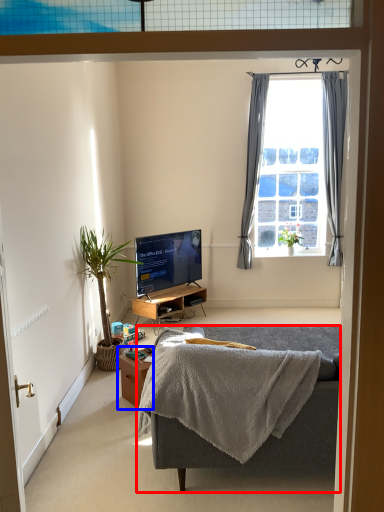
Question: Which of the following is the farthest to the observer, studio couch (highlighted by a red box) or table (highlighted by a blue box)?

Choices:
 (A) studio couch
 (B) table

Answer: (B)